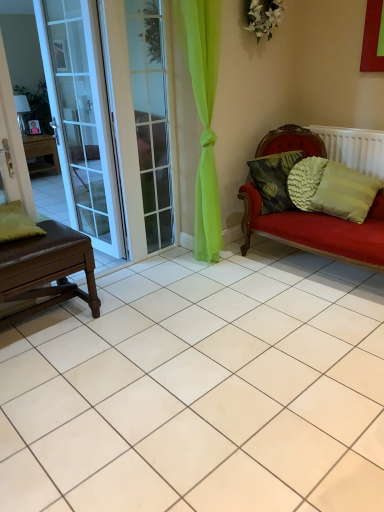
Find the location of a particular element. Image resolution: width=384 pixels, height=512 pixels. free space above white plastic radiator at right (from a real-world perspective) is located at coordinates (355, 124).